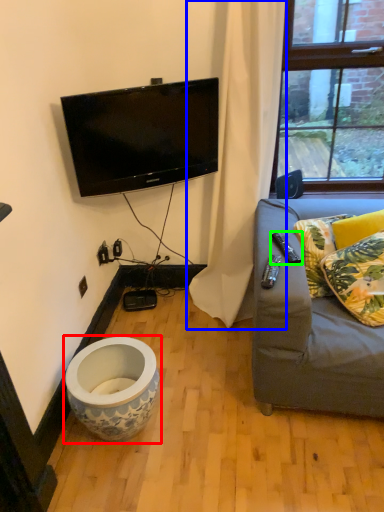
Question: Which object is the closest to the toilet (highlighted by a red box)? Choose among these: curtain (highlighted by a blue box) or remote (highlighted by a green box).

Choices:
 (A) curtain
 (B) remote

Answer: (A)